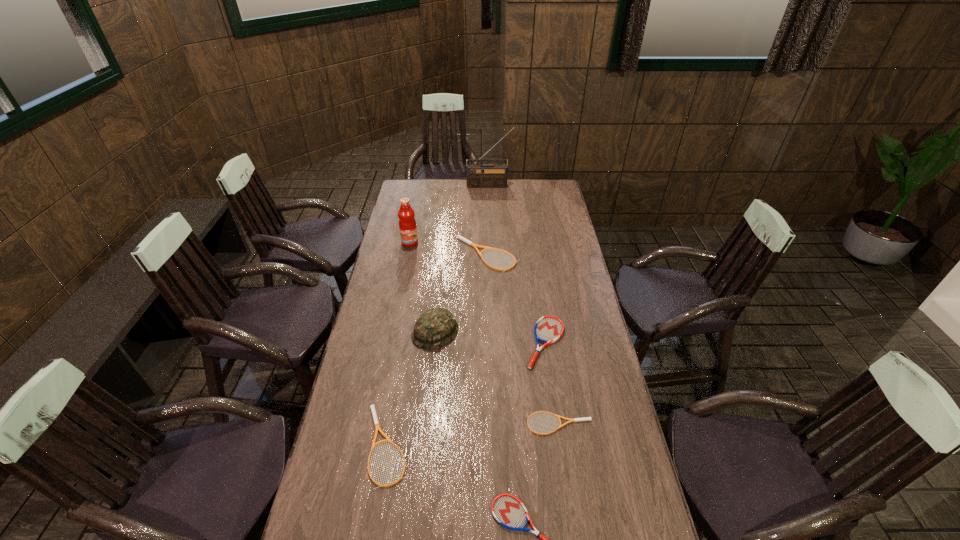
I want to click on the farthest object, so click(478, 175).

This screenshot has width=960, height=540. Find the location of `the tallest object`. the tallest object is located at coordinates (478, 175).

This screenshot has height=540, width=960. Identify the location of fruit juice. (407, 224).

Locate an element on the screen. The width and height of the screenshot is (960, 540). headwear is located at coordinates (436, 327).

The width and height of the screenshot is (960, 540). I want to click on the farthest beige tennis racket, so click(x=463, y=239).

Find the location of a particular element. This screenshot has height=540, width=960. the biggest beige tennis racket is located at coordinates pyautogui.click(x=463, y=239).

Image resolution: width=960 pixels, height=540 pixels. What are the coordinates of `the farther blue tennis racket` in the screenshot? It's located at (548, 329).

The image size is (960, 540). I want to click on the bigger blue tennis racket, so click(548, 329).

Identify the location of the leftmost tennis racket. This screenshot has width=960, height=540. (377, 427).

Locate an element on the screen. Image resolution: width=960 pixels, height=540 pixels. the leftmost beige tennis racket is located at coordinates (377, 427).